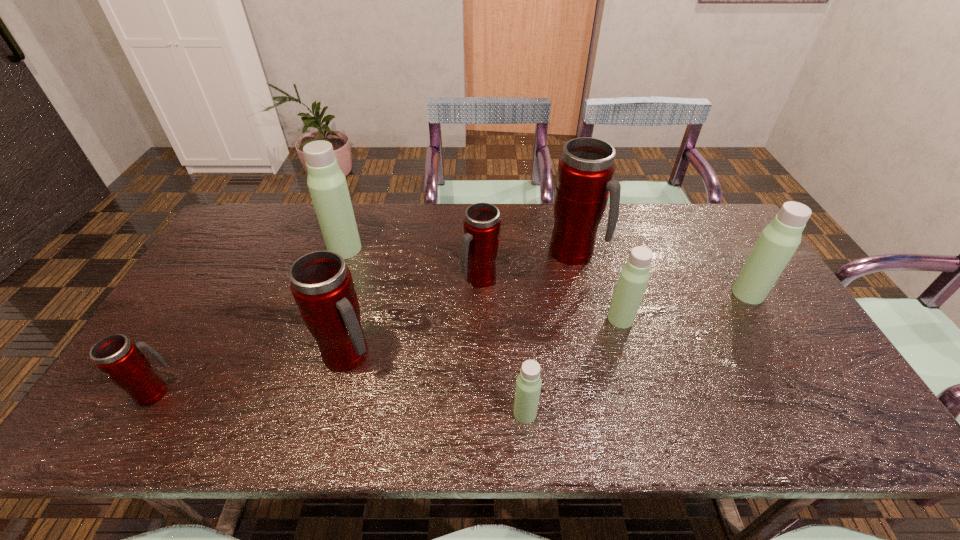
This screenshot has width=960, height=540. I want to click on the leftmost red thermos bottle, so click(x=119, y=358).

The width and height of the screenshot is (960, 540). Identify the location of the smallest red thermos bottle. (119, 358).

The height and width of the screenshot is (540, 960). In order to click on the fifth thermos bottle from left to right in this screenshot , I will do `click(528, 384)`.

Identify the location of the second light thermos bottle from left to right. The image size is (960, 540). (528, 384).

The image size is (960, 540). I want to click on vacant space located 0.390m on the right of the farthest light thermos bottle, so click(482, 249).

The width and height of the screenshot is (960, 540). Find the location of `vacant area situated 0.170m on the side with the handle of the biggest red thermos bottle`. vacant area situated 0.170m on the side with the handle of the biggest red thermos bottle is located at coordinates (655, 253).

You are a GUI agent. You are given a task and a screenshot of the screen. Output one action in this format:
    pyautogui.click(x=<x>, y=<y>)
    Task: Click on the vacant position located on the back of the third smallest light thermos bottle
    The height and width of the screenshot is (540, 960).
    Given the screenshot: What is the action you would take?
    pyautogui.click(x=710, y=231)

Locate an element on the screen. This screenshot has height=540, width=960. vacant space located 0.150m on the side with the handle of the third smallest red thermos bottle is located at coordinates (436, 355).

The image size is (960, 540). In order to click on vacant position located on the side with the handle of the second smallest red thermos bottle in this screenshot , I will do `click(481, 375)`.

Identify the location of vacant space situated on the right of the fifth farthest thermos bottle. The height and width of the screenshot is (540, 960). 739,319.